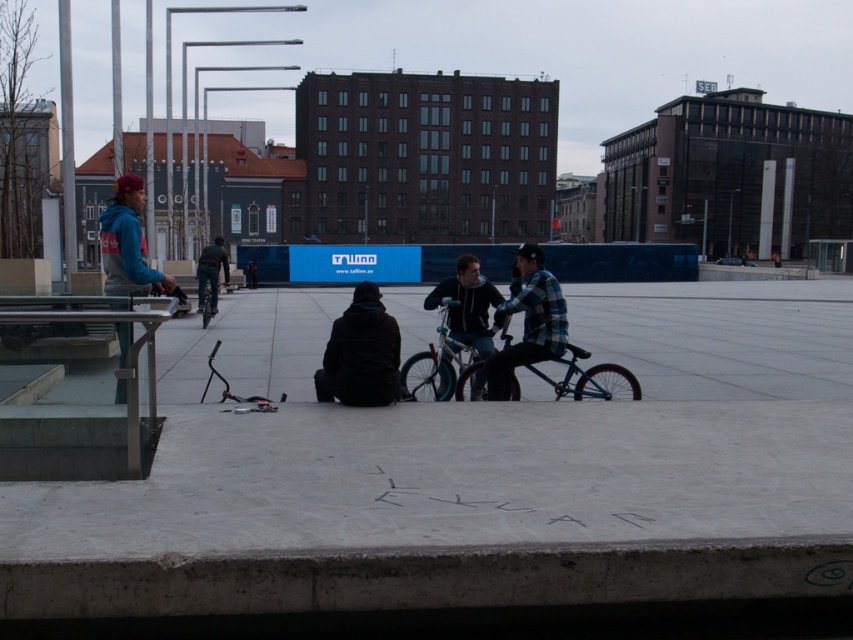
You are a delivery person who needs to park your blue matte bicycle at center in a spot that requires the bicycle to be placed at point exactly at point 0.517, 0.573. Is the current position of the bicycle correct?

The blue matte bicycle at center is at point [440,365], which does not match the required coordinates of [488,330]. Therefore, the bicycle is not correctly positioned.

Looking at this image, you are a delivery person trying to reach the blue metallic bicycle at center. There is a black matte jacket at center in your path. Can you step around it without moving the jacket?

The black matte jacket at center is below the blue metallic bicycle at center, meaning the jacket is under the bicycle. Since the jacket is already positioned under the bicycle, you can step around it without moving the jacket.